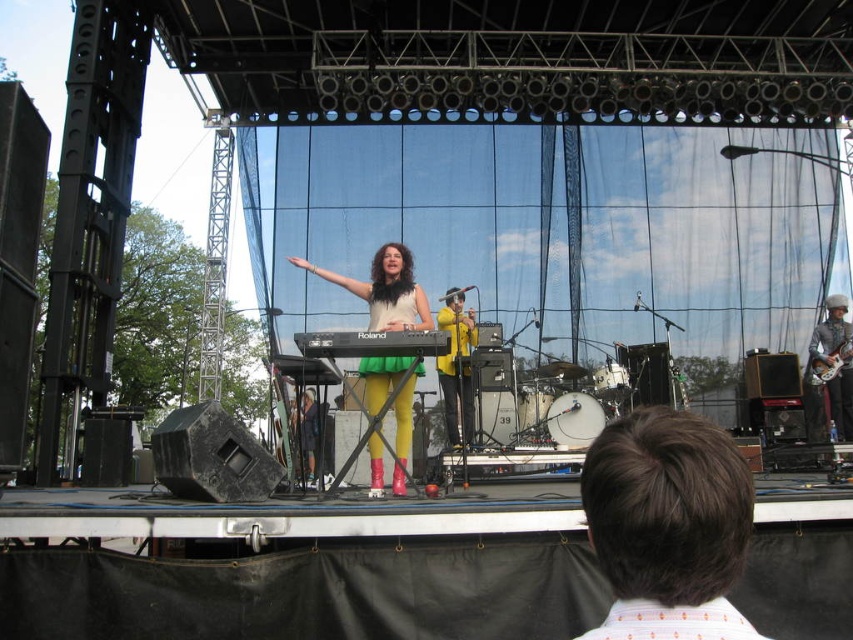
Based on the photo, based on the scene description, can you determine which object is closer to the audience between the brown hair at center and the yellow matte jacket at center?

The brown hair at center is in front of the yellow matte jacket at center, so it is closer to the audience.

You are a photographer at the back of the venue and want to capture a clear photo of both the black plastic keyboard at center and the yellow fabric dress at center. Since the keyboard is above the dress, will you need to adjust your camera angle upwards or downwards to include both in the frame?

Since the black plastic keyboard at center is above the yellow fabric dress at center, you will need to adjust your camera angle upwards to ensure both are visible in the frame.

Looking at this image, you are a photographer at the concert venue and want to capture a photo that includes both the point at coordinates point (651, 520) and the point at coordinates point (370, 413). Which point is closer to the camera lens?

The point at coordinates point (651, 520) is closer to the viewer than the point at coordinates point (370, 413), so it will appear closer to the camera lens in the photo.